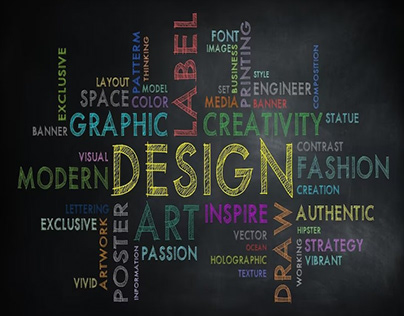
Locate an element on the screen. statue is located at coordinates (339, 109).